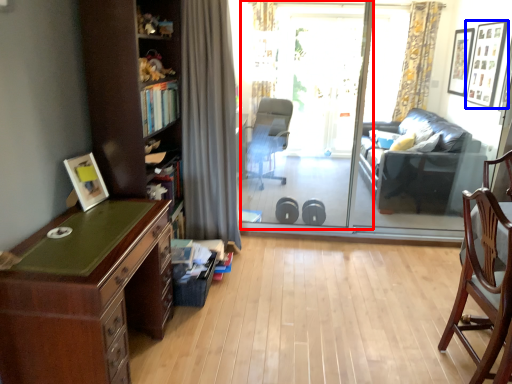
Question: Among these objects, which one is farthest to the camera, screen door (highlighted by a red box) or picture frame (highlighted by a blue box)?

Choices:
 (A) screen door
 (B) picture frame

Answer: (B)